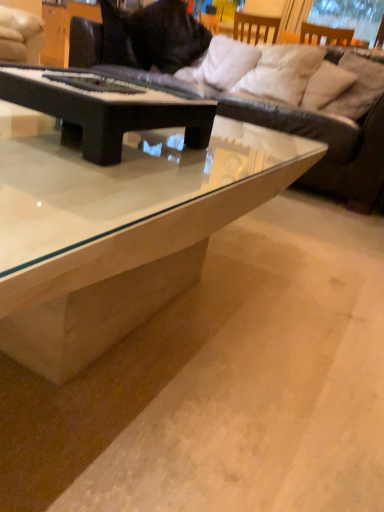
This screenshot has height=512, width=384. What do you see at coordinates (282, 72) in the screenshot?
I see `white soft pillow at upper right, marked as the third pillow in a right-to-left arrangement` at bounding box center [282, 72].

You are a GUI agent. You are given a task and a screenshot of the screen. Output one action in this format:
    pyautogui.click(x=<x>, y=<y>)
    Task: Click on the black matte piano at center, which is the 1th coffee table from back to front
    Image resolution: width=384 pixels, height=512 pixels.
    Given the screenshot: What is the action you would take?
    pyautogui.click(x=106, y=106)

Locate an element on the screen. The height and width of the screenshot is (512, 384). white soft pillow at upper right, placed as the second pillow when sorted from right to left is located at coordinates (326, 85).

This screenshot has height=512, width=384. What are the coordinates of `transparent glass coffee table at center, the second coffee table in the back-to-front sequence` in the screenshot? It's located at (120, 231).

Starting from the beige fabric pillow at upper right, which is the first pillow from right to left, which pillow is the 3rd one to the left? Please provide its 2D coordinates.

[(226, 62)]

Which object is closer to the camera taking this photo, beige fabric pillow at upper right, which is the first pillow from right to left, or white soft pillow at upper center, the 1th pillow in the left-to-right sequence?

beige fabric pillow at upper right, which is the first pillow from right to left, is more forward.

From a real-world perspective, who is located higher, beige fabric pillow at upper right, which is the first pillow from right to left, or white soft pillow at upper center, the 1th pillow in the left-to-right sequence?

beige fabric pillow at upper right, which is the first pillow from right to left.

Which is behind, point (277, 62) or point (376, 90)?

Positioned behind is point (277, 62).

From a real-world perspective, which is physically below, white soft pillow at upper right, marked as the second pillow in a left-to-right arrangement, or beige fabric pillow at upper right, which appears as the 4th pillow when viewed from the left?

From a 3D spatial view, white soft pillow at upper right, marked as the second pillow in a left-to-right arrangement, is below.

Is white soft pillow at upper right, marked as the second pillow in a left-to-right arrangement, far from beige fabric pillow at upper right, which is the first pillow from right to left?

white soft pillow at upper right, marked as the second pillow in a left-to-right arrangement, is near beige fabric pillow at upper right, which is the first pillow from right to left, not far away.

Which is more to the left, white soft pillow at upper right, marked as the second pillow in a left-to-right arrangement, or beige fabric pillow at upper right, which is the first pillow from right to left?

From the viewer's perspective, white soft pillow at upper right, marked as the second pillow in a left-to-right arrangement, appears more on the left side.

Considering the positions of objects transparent glass coffee table at center, which is the first coffee table in front-to-back order, and black leather couch at upper center in the image provided, who is behind, transparent glass coffee table at center, which is the first coffee table in front-to-back order, or black leather couch at upper center?

Positioned behind is black leather couch at upper center.

Based on their sizes in the image, would you say transparent glass coffee table at center, the second coffee table in the back-to-front sequence, is bigger or smaller than black leather couch at upper center?

Clearly, transparent glass coffee table at center, the second coffee table in the back-to-front sequence, is smaller in size than black leather couch at upper center.

From the image's perspective, is transparent glass coffee table at center, which is the first coffee table in front-to-back order, on black leather couch at upper center?

No.

Is black matte piano at center, which appears as the 2th coffee table when viewed from the front, inside the boundaries of transparent glass coffee table at center, which is the first coffee table in front-to-back order, or outside?

The correct answer is: outside.

Which is less distant, [162,104] or [317,160]?

The point [162,104] is in front.

In terms of width, does black matte piano at center, which is the 1th coffee table from back to front, look wider or thinner when compared to transparent glass coffee table at center, the second coffee table in the back-to-front sequence?

black matte piano at center, which is the 1th coffee table from back to front, is thinner than transparent glass coffee table at center, the second coffee table in the back-to-front sequence.

You are a GUI agent. You are given a task and a screenshot of the screen. Output one action in this format:
    pyautogui.click(x=<x>, y=<y>)
    Task: Click on the coffee table directly beneath the black matte piano at center, which is the 1th coffee table from back to front (from a real-world perspective)
    The height and width of the screenshot is (512, 384).
    Given the screenshot: What is the action you would take?
    pyautogui.click(x=120, y=231)

Does point (380, 73) come closer to viewer compared to point (256, 91)?

That is True.

Looking at their sizes, would you say beige fabric pillow at upper right, which appears as the 4th pillow when viewed from the left, is wider or thinner than white soft pillow at upper right, marked as the third pillow in a right-to-left arrangement?

beige fabric pillow at upper right, which appears as the 4th pillow when viewed from the left, is thinner than white soft pillow at upper right, marked as the third pillow in a right-to-left arrangement.

Between beige fabric pillow at upper right, which appears as the 4th pillow when viewed from the left, and white soft pillow at upper right, marked as the third pillow in a right-to-left arrangement, which one is positioned in front?

beige fabric pillow at upper right, which appears as the 4th pillow when viewed from the left, is closer to the camera.

Is black leather couch at upper center aimed at black matte piano at center, which is the 1th coffee table from back to front?

Yes, black leather couch at upper center is aimed at black matte piano at center, which is the 1th coffee table from back to front.

Considering the relative positions of black leather couch at upper center and black matte piano at center, which appears as the 2th coffee table when viewed from the front, in the image provided, is black leather couch at upper center in front of black matte piano at center, which appears as the 2th coffee table when viewed from the front,?

No.

What's the angular difference between black leather couch at upper center and black matte piano at center, which is the 1th coffee table from back to front,'s facing directions?

92 degrees separate the facing orientations of black leather couch at upper center and black matte piano at center, which is the 1th coffee table from back to front.

In the scene shown: How far apart are black leather couch at upper center and black matte piano at center, which is the 1th coffee table from back to front?

black leather couch at upper center and black matte piano at center, which is the 1th coffee table from back to front, are 4.63 feet apart.

Looking at this image, between white soft pillow at upper right, marked as the third pillow in a right-to-left arrangement, and white soft pillow at upper right, arranged as the third pillow when viewed from the left, which one appears on the right side from the viewer's perspective?

white soft pillow at upper right, arranged as the third pillow when viewed from the left, is more to the right.

Is white soft pillow at upper right, marked as the second pillow in a left-to-right arrangement, positioned beyond the bounds of white soft pillow at upper right, arranged as the third pillow when viewed from the left?

Absolutely, white soft pillow at upper right, marked as the second pillow in a left-to-right arrangement, is external to white soft pillow at upper right, arranged as the third pillow when viewed from the left.

Is white soft pillow at upper right, marked as the third pillow in a right-to-left arrangement, facing towards white soft pillow at upper right, placed as the second pillow when sorted from right to left?

No.

Considering the positions of point (312, 65) and point (316, 83), is point (312, 65) closer or farther from the camera than point (316, 83)?

Clearly, point (312, 65) is more distant from the camera than point (316, 83).

From the image's perspective, starting from the white soft pillow at upper center, placed as the fourth pillow when sorted from right to left, which pillow is the 3rd one below? Please provide its 2D coordinates.

[(357, 86)]

From the beige fabric pillow at upper right, which appears as the 4th pillow when viewed from the left, count 2nd pillows backward and point to it. Please provide its 2D coordinates.

[(282, 72)]

Looking at the image, which one is located closer to white soft pillow at upper right, placed as the second pillow when sorted from right to left, transparent glass coffee table at center, the second coffee table in the back-to-front sequence, or white soft pillow at upper right, marked as the second pillow in a left-to-right arrangement?

Among the two, white soft pillow at upper right, marked as the second pillow in a left-to-right arrangement, is located nearer to white soft pillow at upper right, placed as the second pillow when sorted from right to left.

From the image, which object appears to be farther from beige fabric pillow at upper right, which is the first pillow from right to left, white soft pillow at upper right, marked as the third pillow in a right-to-left arrangement, or black leather couch at upper center?

black leather couch at upper center lies further to beige fabric pillow at upper right, which is the first pillow from right to left, than the other object.

Estimate the real-world distances between objects in this image. Which object is further from white soft pillow at upper right, marked as the third pillow in a right-to-left arrangement, black matte piano at center, which is the 1th coffee table from back to front, or beige fabric pillow at upper right, which appears as the 4th pillow when viewed from the left?

→ Among the two, black matte piano at center, which is the 1th coffee table from back to front, is located further to white soft pillow at upper right, marked as the third pillow in a right-to-left arrangement.

Estimate the real-world distances between objects in this image. Which object is closer to white soft pillow at upper center, the 1th pillow in the left-to-right sequence, beige fabric pillow at upper right, which appears as the 4th pillow when viewed from the left, or black matte piano at center, which is the 1th coffee table from back to front?

beige fabric pillow at upper right, which appears as the 4th pillow when viewed from the left, is positioned closer to the anchor white soft pillow at upper center, the 1th pillow in the left-to-right sequence.

In the scene shown: When comparing their distances from black leather couch at upper center, does white soft pillow at upper right, marked as the second pillow in a left-to-right arrangement, or black matte piano at center, which is the 1th coffee table from back to front, seem closer?

white soft pillow at upper right, marked as the second pillow in a left-to-right arrangement, is positioned closer to the anchor black leather couch at upper center.

Considering their positions, is white soft pillow at upper right, marked as the third pillow in a right-to-left arrangement, positioned closer to white soft pillow at upper right, arranged as the third pillow when viewed from the left, than black leather couch at upper center?

white soft pillow at upper right, marked as the third pillow in a right-to-left arrangement.

Considering their positions, is black matte piano at center, which appears as the 2th coffee table when viewed from the front, positioned further to white soft pillow at upper right, placed as the second pillow when sorted from right to left, than beige fabric pillow at upper right, which appears as the 4th pillow when viewed from the left?

Based on the image, black matte piano at center, which appears as the 2th coffee table when viewed from the front, appears to be further to white soft pillow at upper right, placed as the second pillow when sorted from right to left.

Looking at the image, which one is located closer to white soft pillow at upper right, placed as the second pillow when sorted from right to left, white soft pillow at upper center, the 1th pillow in the left-to-right sequence, or white soft pillow at upper right, marked as the third pillow in a right-to-left arrangement?

white soft pillow at upper right, marked as the third pillow in a right-to-left arrangement.

The image size is (384, 512). Find the location of `studio couch between black matte piano at center, which is the 1th coffee table from back to front, and white soft pillow at upper center, the 1th pillow in the left-to-right sequence, along the z-axis`. studio couch between black matte piano at center, which is the 1th coffee table from back to front, and white soft pillow at upper center, the 1th pillow in the left-to-right sequence, along the z-axis is located at coordinates (328, 148).

This screenshot has height=512, width=384. Identify the location of studio couch located between transparent glass coffee table at center, the second coffee table in the back-to-front sequence, and white soft pillow at upper center, the 1th pillow in the left-to-right sequence, in the depth direction. (328, 148).

I want to click on studio couch between black matte piano at center, which is the 1th coffee table from back to front, and white soft pillow at upper right, marked as the second pillow in a left-to-right arrangement, in the front-back direction, so pos(328,148).

The image size is (384, 512). Find the location of `studio couch located between transparent glass coffee table at center, the second coffee table in the back-to-front sequence, and white soft pillow at upper right, marked as the third pillow in a right-to-left arrangement, in the depth direction`. studio couch located between transparent glass coffee table at center, the second coffee table in the back-to-front sequence, and white soft pillow at upper right, marked as the third pillow in a right-to-left arrangement, in the depth direction is located at coordinates (328, 148).